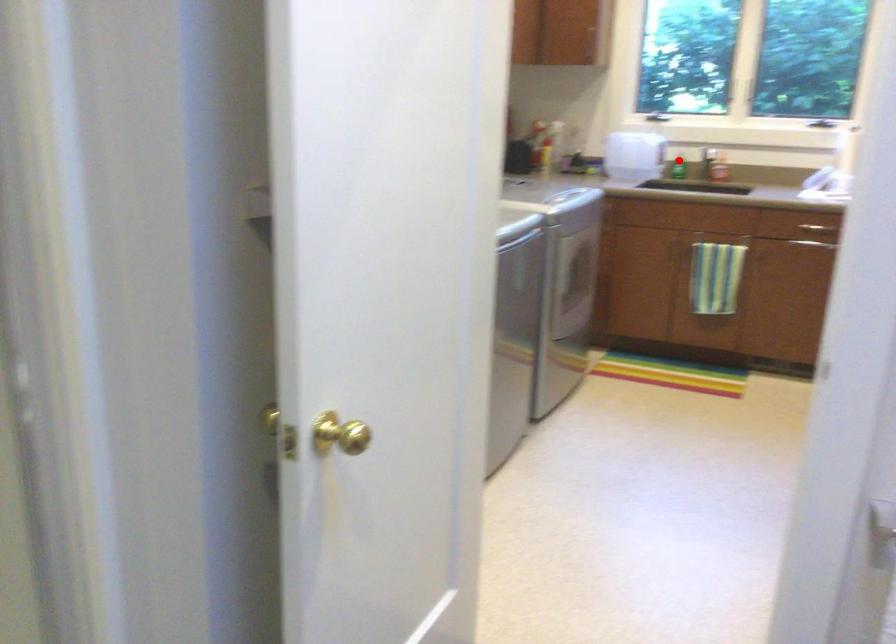
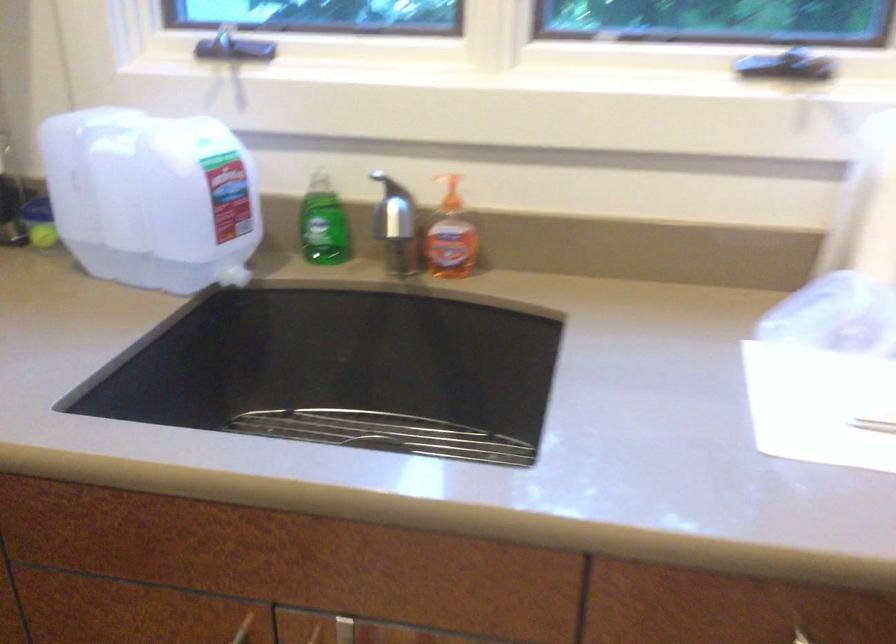
Question: I am providing you with two images of the same scene from different viewpoints. Given a red point in image1, look at the same physical point in image2. Is it:

Choices:
 (A) Closer to the viewpoint
 (B) Farther from the viewpoint

Answer: (A)